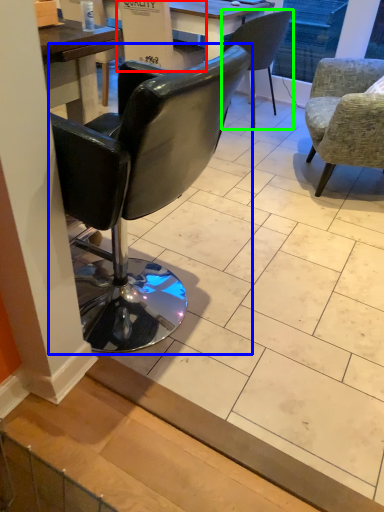
Question: Which object is positioned closest to armchair (highlighted by a red box)? Select from chair (highlighted by a blue box) and chair (highlighted by a green box).

Choices:
 (A) chair
 (B) chair

Answer: (B)